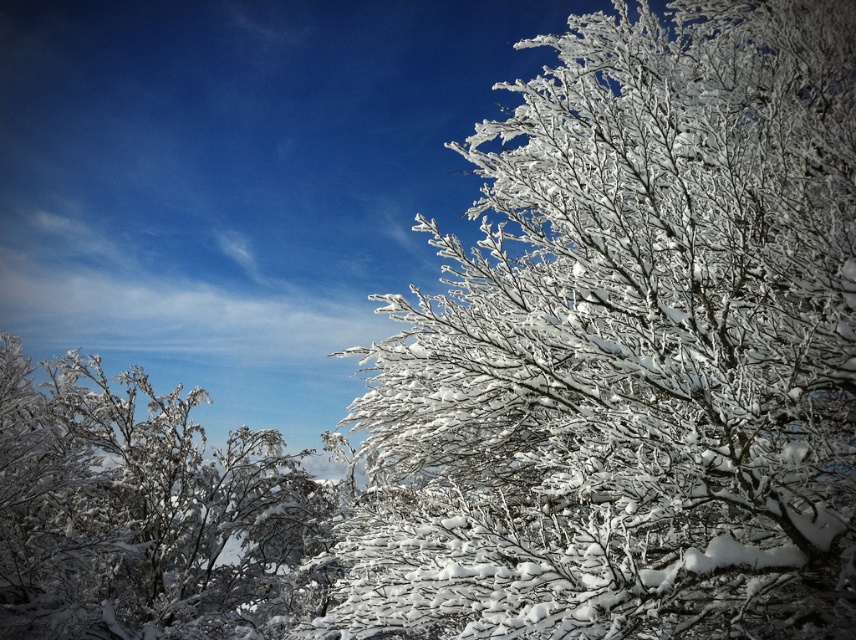
Between snow-covered branches at upper right and white frosty branches at left, which one appears on the left side from the viewer's perspective?

white frosty branches at left is more to the left.

Image resolution: width=856 pixels, height=640 pixels. I want to click on snow-covered branches at upper right, so click(629, 349).

The image size is (856, 640). Find the location of `snow-covered branches at upper right`. snow-covered branches at upper right is located at coordinates (629, 349).